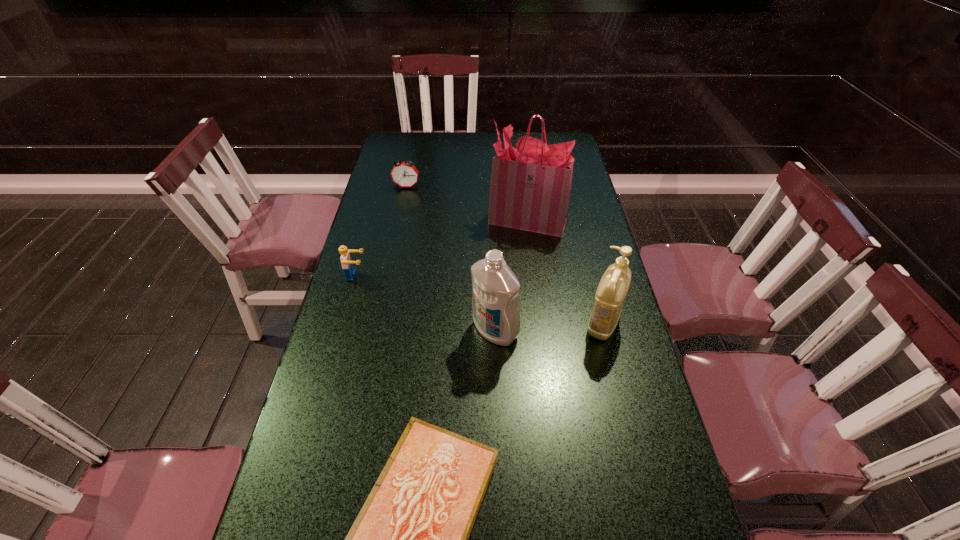
Find the location of `vacant area that lies between the alarm clock and the second farthest object`. vacant area that lies between the alarm clock and the second farthest object is located at coordinates (468, 204).

This screenshot has height=540, width=960. Identify the location of free space between the fifth shortest object and the shorter detergent. (549, 327).

You are a GUI agent. You are given a task and a screenshot of the screen. Output one action in this format:
    pyautogui.click(x=<x>, y=<y>)
    Task: Click on the vacant space that's between the alarm clock and the third farthest object
    The height and width of the screenshot is (540, 960).
    Given the screenshot: What is the action you would take?
    pyautogui.click(x=381, y=231)

Locate an element on the screen. Image resolution: width=960 pixels, height=540 pixels. vacant point located between the shopping bag and the Lego is located at coordinates (442, 248).

Locate an element on the screen. free space between the left detergent and the farthest object is located at coordinates (451, 259).

Image resolution: width=960 pixels, height=540 pixels. In order to click on free space between the shorter detergent and the second tallest object in this screenshot , I will do `click(549, 327)`.

Choose which object is the fifth nearest neighbor to the second tallest object. Please provide its 2D coordinates. Your answer should be formatted as a tuple, i.e. [(x, y)], where the tuple contains the x and y coordinates of a point satisfying the conditions above.

[(404, 174)]

At what (x,y) coordinates should I click in order to perform the action: click on object that is the third closest to the taller detergent. Please return your answer as a coordinate pair (x, y). The height and width of the screenshot is (540, 960). Looking at the image, I should click on (530, 189).

Identify the location of free space that satisfies the following two spatial constraints: 1. on the face of the fourth shortest object; 2. on the left side of the Lego. (343, 324).

This screenshot has height=540, width=960. In order to click on free space that satisfies the following two spatial constraints: 1. on the front side of the shopping bag; 2. on the face of the leftmost object in this screenshot , I will do `click(535, 276)`.